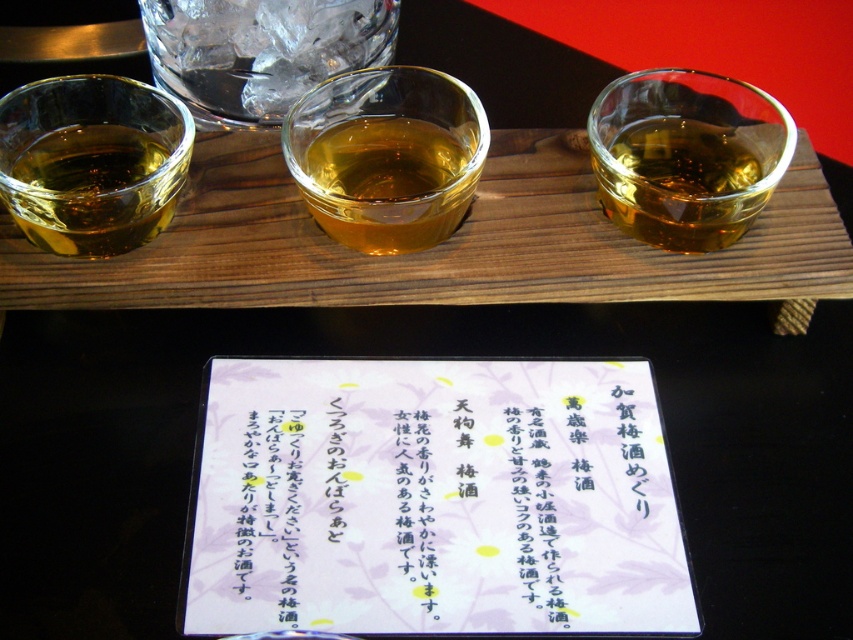
Question: Is the position of translucent amber liquid at center less distant than that of translucent amber liquid at left?

Choices:
 (A) yes
 (B) no

Answer: (B)

Question: Which of the following is the farthest from the observer?

Choices:
 (A) translucent amber liquid at right
 (B) translucent amber liquid at left
 (C) white paper at center
 (D) translucent glass at upper center

Answer: (D)

Question: Which point is closer to the camera?

Choices:
 (A) translucent amber liquid at center
 (B) translucent glass at upper center
 (C) white paper at center

Answer: (C)

Question: Which of the following is the closest to the observer?

Choices:
 (A) (427, 122)
 (B) (384, 563)
 (C) (218, 67)
 (D) (151, 157)

Answer: (B)

Question: Does white paper at center have a greater width compared to translucent amber liquid at right?

Choices:
 (A) no
 (B) yes

Answer: (B)

Question: Is translucent amber liquid at right further to camera compared to translucent amber liquid at left?

Choices:
 (A) no
 (B) yes

Answer: (B)